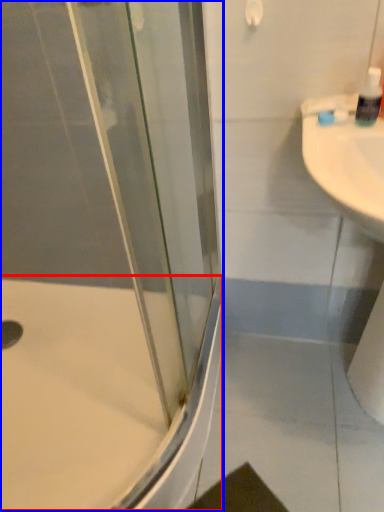
Question: Among these objects, which one is nearest to the camera, bath (highlighted by a red box) or shower door (highlighted by a blue box)?

Choices:
 (A) bath
 (B) shower door

Answer: (B)